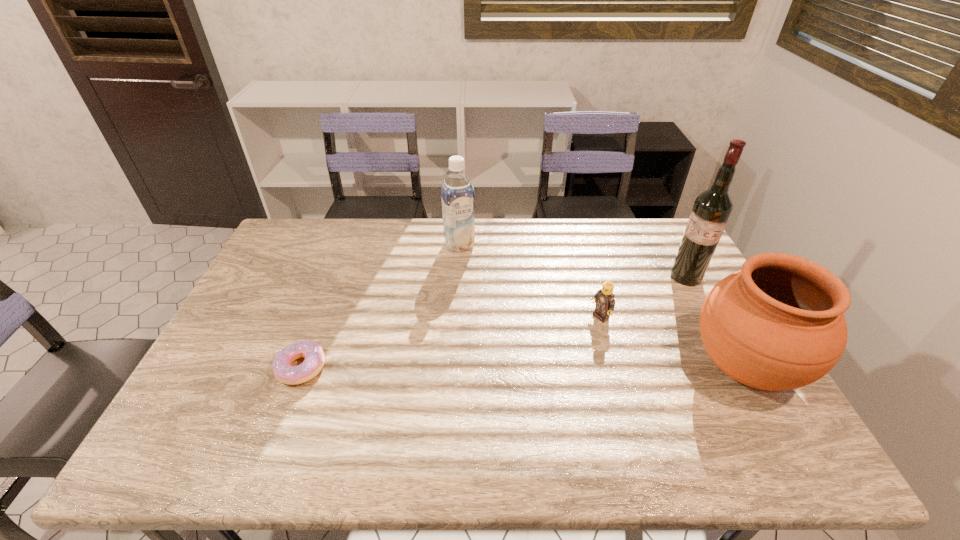
This screenshot has width=960, height=540. Identify the location of object located at the far edge. click(x=457, y=193).

Where is `object located at the near edge`? This screenshot has height=540, width=960. object located at the near edge is located at coordinates (777, 324).

Where is `pottery that is at the right edge`? This screenshot has height=540, width=960. pottery that is at the right edge is located at coordinates (777, 324).

The width and height of the screenshot is (960, 540). In order to click on wine bottle present at the right edge in this screenshot , I will do `click(711, 211)`.

The width and height of the screenshot is (960, 540). Identify the location of object positioned at the near right corner. (777, 324).

What are the coordinates of `free region at the far edge of the desktop` in the screenshot? It's located at (569, 219).

The height and width of the screenshot is (540, 960). In the image, there is a desktop. In order to click on free space at the near edge in this screenshot , I will do `click(654, 399)`.

In the image, there is a desktop. In order to click on free region at the left edge in this screenshot , I will do `click(268, 278)`.

Where is `vacant space at the right edge of the desktop`? vacant space at the right edge of the desktop is located at coordinates (731, 381).

In the image, there is a desktop. At what (x,y) coordinates should I click in order to perform the action: click on vacant region at the far left corner. Please return your answer as a coordinate pair (x, y). Image resolution: width=960 pixels, height=540 pixels. Looking at the image, I should click on (304, 229).